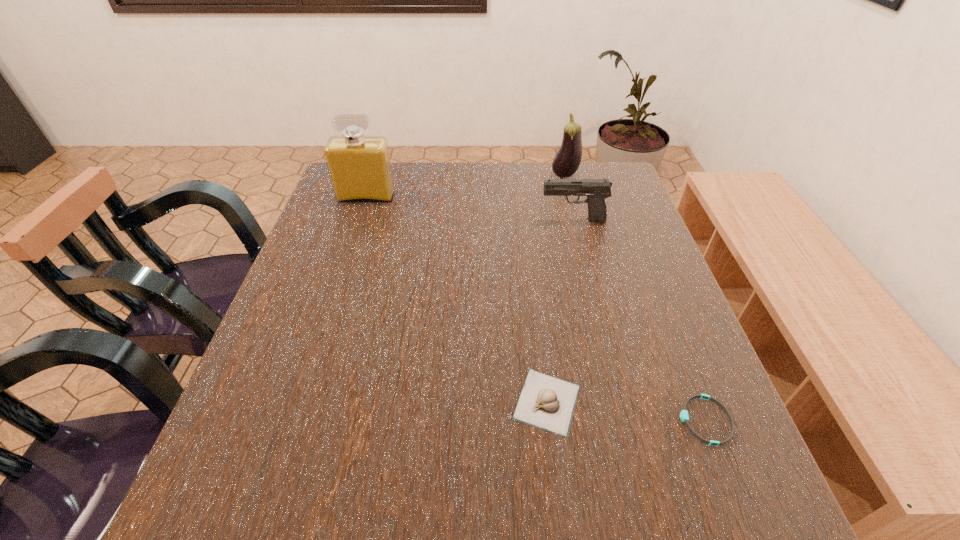
The height and width of the screenshot is (540, 960). I want to click on free spot between the perfume and the third nearest object, so coord(469,209).

The height and width of the screenshot is (540, 960). Find the location of `blank region between the garlic and the tallest object`. blank region between the garlic and the tallest object is located at coordinates pyautogui.click(x=457, y=300).

This screenshot has width=960, height=540. I want to click on object that stands as the fourth closest to the leftmost object, so click(684, 417).

The width and height of the screenshot is (960, 540). I want to click on object that stands as the closest to the pistol, so click(x=566, y=162).

Where is `vacant space that satisfies the following two spatial constraints: 1. on the front-facing side of the leftmost object; 2. on the left side of the second shortest object`? vacant space that satisfies the following two spatial constraints: 1. on the front-facing side of the leftmost object; 2. on the left side of the second shortest object is located at coordinates click(300, 402).